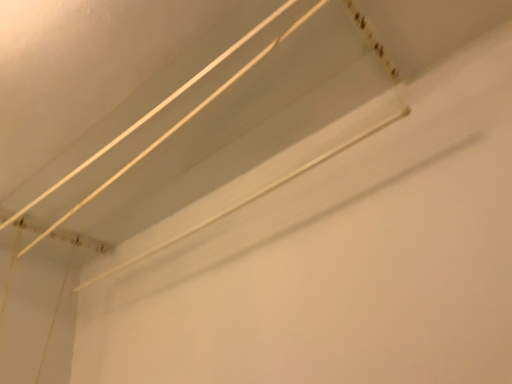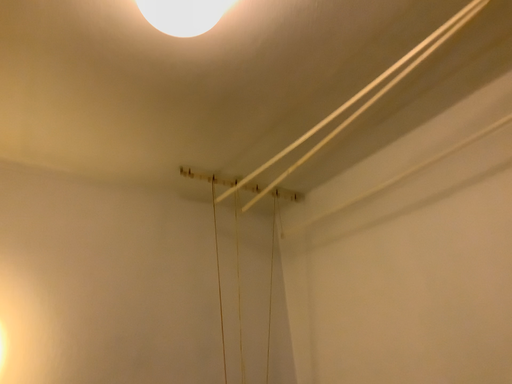
Question: Which way did the camera rotate in the video?

Choices:
 (A) rotated downward
 (B) rotated upward

Answer: (A)